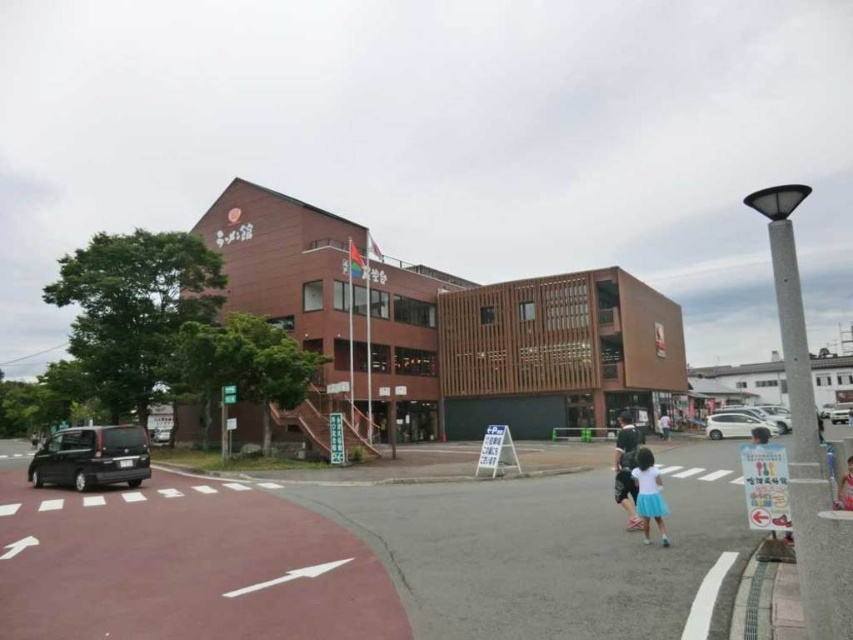
You are a delivery person needing to park your vehicle in front of the modern building. You have a shiny black van at lower left and a satin silver sedan at right. Which vehicle is positioned closer to the left side of the entrance?

The shiny black van at lower left is positioned closer to the left side of the entrance because it is to the left of the satin silver sedan at right.

You are a delivery person approaching the shiny black van at lower left and the satin silver sedan at right parked near the building. Which vehicle is closer to the entrance of the building?

The shiny black van at lower left is closer to the entrance of the building because it is in front of the satin silver sedan at right, meaning it is positioned nearer to the entrance.

You are a delivery person trying to park your shiny black van at lower left near the building entrance. However, there is a satin silver sedan at right blocking the path. Can you maneuver your van around the sedan to reach the entrance?

The shiny black van at lower left is positioned under the satin silver sedan at right, which means the sedan is blocking the van from moving forward. You will need to wait for the sedan to move before proceeding.